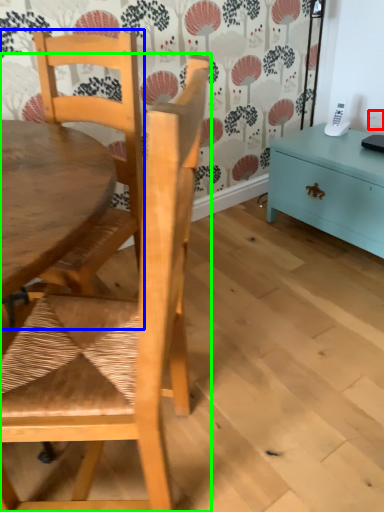
Question: Which object is the closest to the power outlet (highlighted by a red box)? Choose among these: chair (highlighted by a blue box) or chair (highlighted by a green box).

Choices:
 (A) chair
 (B) chair

Answer: (A)